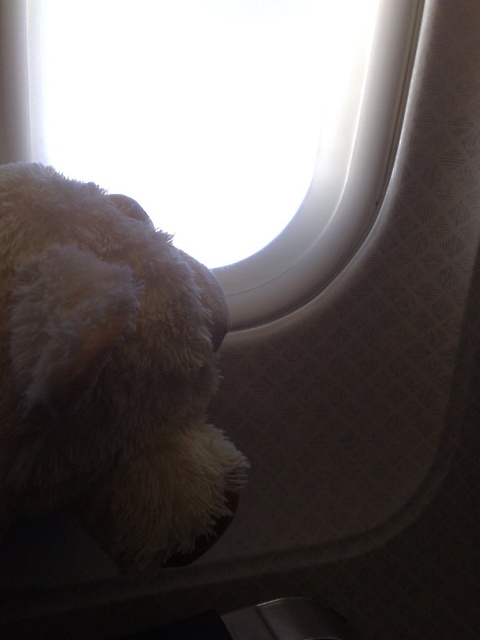
Question: Can you confirm if white fluffy stuffed animal at left is positioned to the right of white fluffy teddy bear at lower left?

Choices:
 (A) yes
 (B) no

Answer: (B)

Question: Considering the relative positions of white fluffy stuffed animal at left and white fluffy teddy bear at lower left in the image provided, where is white fluffy stuffed animal at left located with respect to white fluffy teddy bear at lower left?

Choices:
 (A) below
 (B) above

Answer: (A)

Question: Is white fluffy stuffed animal at left thinner than white fluffy teddy bear at lower left?

Choices:
 (A) no
 (B) yes

Answer: (B)